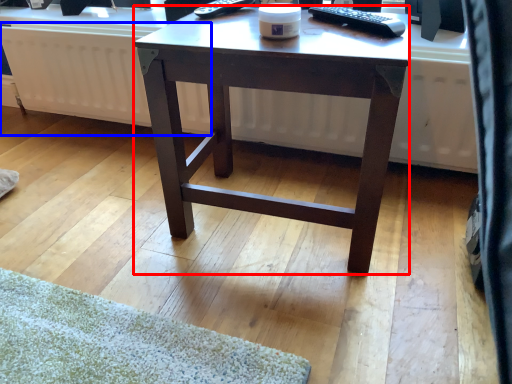
Question: Which point is further to the camera, desk (highlighted by a red box) or radiator (highlighted by a blue box)?

Choices:
 (A) desk
 (B) radiator

Answer: (B)